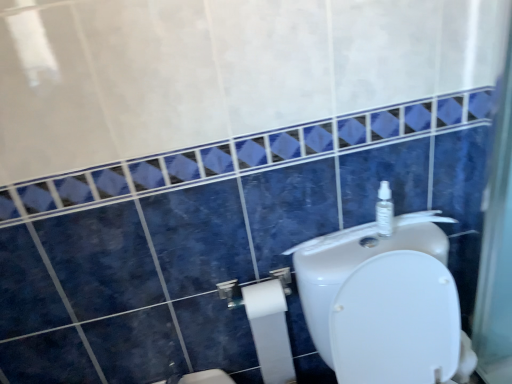
Question: Considering the relative positions of white matte toilet paper at lower center and white matte toilet paper at lower center in the image provided, is white matte toilet paper at lower center to the right of white matte toilet paper at lower center from the viewer's perspective?

Choices:
 (A) yes
 (B) no

Answer: (A)

Question: Would you consider white matte toilet paper at lower center to be distant from white matte toilet paper at lower center?

Choices:
 (A) no
 (B) yes

Answer: (A)

Question: Is white matte toilet paper at lower center bigger than white matte toilet paper at lower center?

Choices:
 (A) no
 (B) yes

Answer: (B)

Question: Considering the relative sizes of white matte toilet paper at lower center and white matte toilet paper at lower center in the image provided, is white matte toilet paper at lower center taller than white matte toilet paper at lower center?

Choices:
 (A) no
 (B) yes

Answer: (B)

Question: From a real-world perspective, is white matte toilet paper at lower center on top of white matte toilet paper at lower center?

Choices:
 (A) no
 (B) yes

Answer: (A)

Question: Is white matte toilet paper at lower center positioned beyond the bounds of white matte toilet paper at lower center?

Choices:
 (A) no
 (B) yes

Answer: (B)

Question: From the image's perspective, would you say white glossy toilet at upper right is shown under clear plastic spray bottle at upper right?

Choices:
 (A) yes
 (B) no

Answer: (A)

Question: Is white glossy toilet at upper right facing away from clear plastic spray bottle at upper right?

Choices:
 (A) no
 (B) yes

Answer: (A)

Question: Can you confirm if white glossy toilet at upper right is positioned to the left of clear plastic spray bottle at upper right?

Choices:
 (A) yes
 (B) no

Answer: (B)

Question: Is white glossy toilet at upper right facing towards clear plastic spray bottle at upper right?

Choices:
 (A) no
 (B) yes

Answer: (A)

Question: Are white glossy toilet at upper right and clear plastic spray bottle at upper right beside each other?

Choices:
 (A) no
 (B) yes

Answer: (A)

Question: From a real-world perspective, is white glossy toilet at upper right on clear plastic spray bottle at upper right?

Choices:
 (A) yes
 (B) no

Answer: (B)

Question: Could you tell me if clear plastic spray bottle at upper right is turned towards white matte toilet paper at lower center?

Choices:
 (A) yes
 (B) no

Answer: (B)